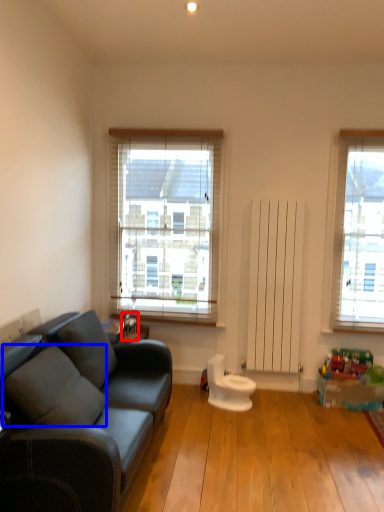
Question: Which of the following is the closest to the observer, toy (highlighted by a red box) or pillow (highlighted by a blue box)?

Choices:
 (A) toy
 (B) pillow

Answer: (B)